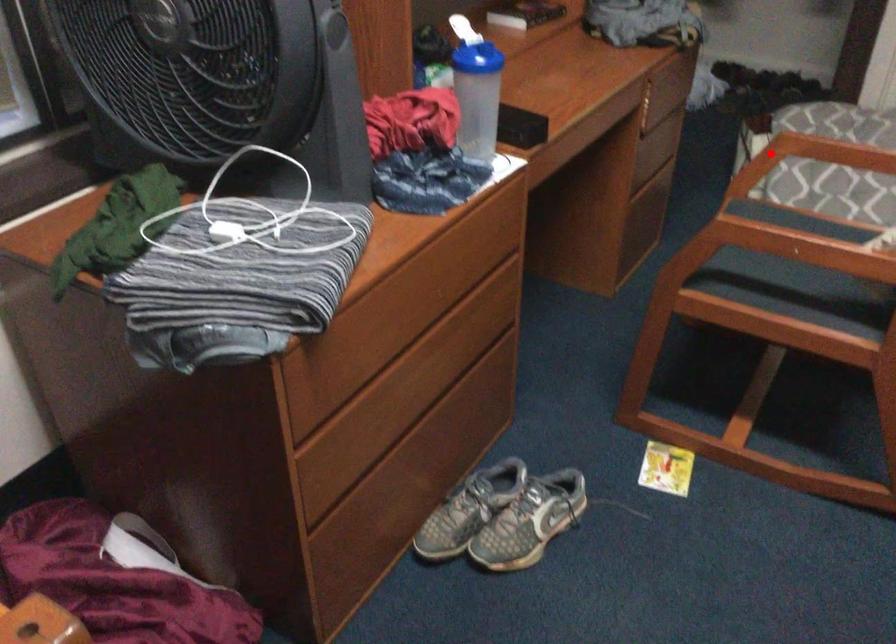
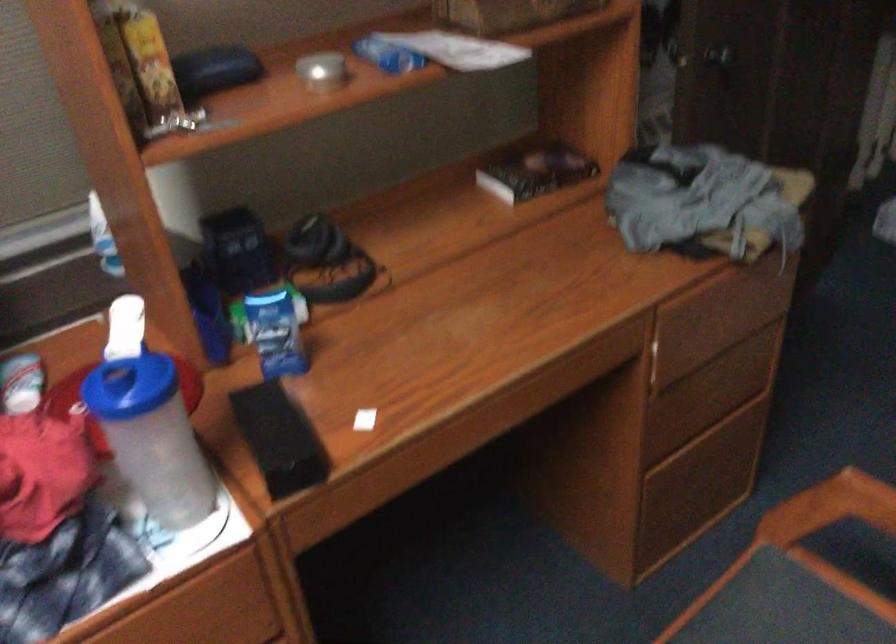
Find the pixel in the second image that matches the highlighted location in the first image.

(830, 507)